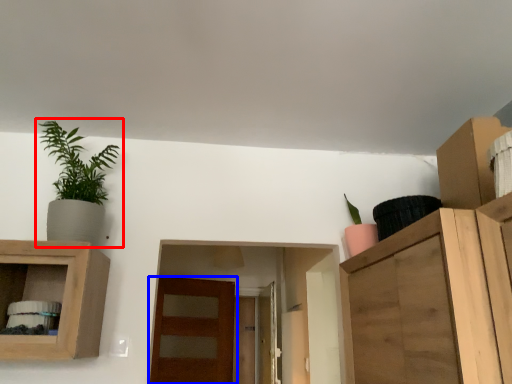
Question: Which point is further to the camera, houseplant (highlighted by a red box) or door (highlighted by a blue box)?

Choices:
 (A) houseplant
 (B) door

Answer: (B)